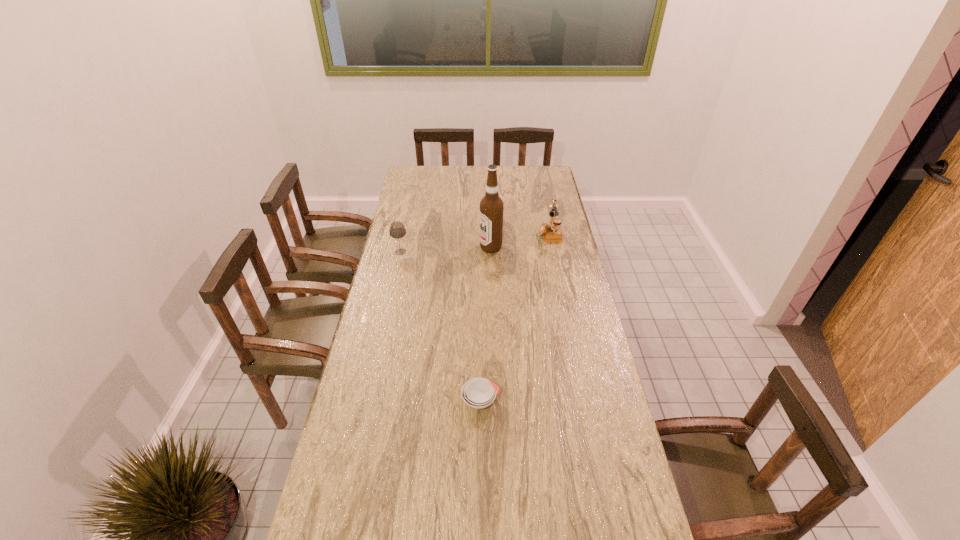
This screenshot has height=540, width=960. I want to click on alcohol, so click(491, 206).

Find the location of `telephone`. telephone is located at coordinates (552, 232).

I want to click on the leftmost object, so click(397, 230).

Where is `the shortest object`? This screenshot has height=540, width=960. the shortest object is located at coordinates (478, 393).

Find the location of a particular element. This screenshot has height=540, width=960. soup bowl is located at coordinates (478, 393).

Where is `free region located on the label of the alcohol`? This screenshot has height=540, width=960. free region located on the label of the alcohol is located at coordinates (410, 248).

At what (x,y) coordinates should I click in order to perform the action: click on vacant space situated 0.340m on the label of the alcohol. Please return your answer as a coordinate pair (x, y). Image resolution: width=960 pixels, height=540 pixels. Looking at the image, I should click on (400, 248).

At what (x,y) coordinates should I click in order to perform the action: click on blank area located 0.270m on the label of the alcohol. Please return your answer as a coordinate pair (x, y). Looking at the image, I should click on (417, 248).

I want to click on free location located 0.310m on the dial number of the rightmost object, so click(x=468, y=233).

Where is `free region located 0.260m on the dial number of the rightmost object`? free region located 0.260m on the dial number of the rightmost object is located at coordinates (479, 233).